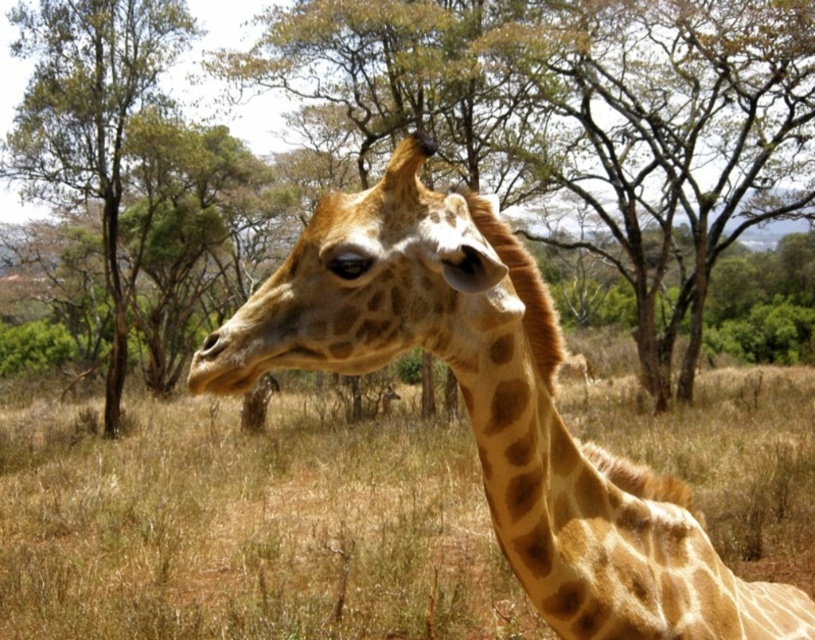
You are a bird looking for a place to perch. You see two trees in the center of the image. Which tree would require you to land on a thinner trunk, the brown wood tree at center or the brown textured tree at center?

The brown wood tree at center has a thinner trunk compared to the brown textured tree at center, so you should choose the brown wood tree at center to land on if you prefer a thinner trunk.

You are a photographer standing in the savanna. You want to capture a photo of the spotted fur giraffe at center while ensuring the brown dry grass at center is visible in the background. Based on their positions, can you achieve this composition?

The brown dry grass at center is located below the spotted fur giraffe at center, so yes, the photographer can position the giraffe at the top part of the frame and have the brown dry grass at center visible in the lower background.

You are a photographer trying to capture a clear shot of the spotted fur giraffe at center and the brown textured tree at center. Based on their positions, which object would appear closer to the camera in the photo?

The spotted fur giraffe at center appears closer to the camera because it is positioned in front of the brown textured tree at center.